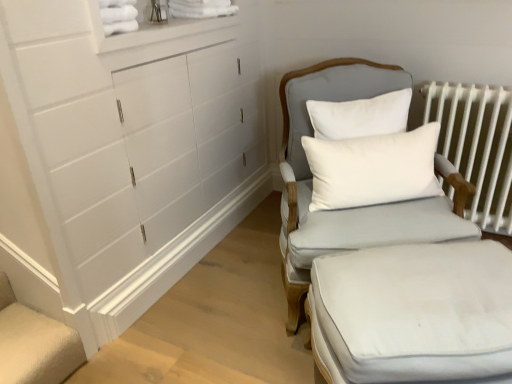
Question: From the image's perspective, is white fabric ottoman at lower right above white metal radiator at right?

Choices:
 (A) no
 (B) yes

Answer: (A)

Question: Considering the relative sizes of white fabric ottoman at lower right and white metal radiator at right in the image provided, is white fabric ottoman at lower right taller than white metal radiator at right?

Choices:
 (A) yes
 (B) no

Answer: (B)

Question: Could you tell me if white fabric ottoman at lower right is turned towards white metal radiator at right?

Choices:
 (A) yes
 (B) no

Answer: (B)

Question: From a real-world perspective, is white fabric ottoman at lower right below white metal radiator at right?

Choices:
 (A) no
 (B) yes

Answer: (B)

Question: Is white fabric ottoman at lower right thinner than white metal radiator at right?

Choices:
 (A) no
 (B) yes

Answer: (A)

Question: Considering the relative sizes of white fabric ottoman at lower right and white metal radiator at right in the image provided, is white fabric ottoman at lower right wider than white metal radiator at right?

Choices:
 (A) yes
 (B) no

Answer: (A)

Question: From the image's perspective, is white metal radiator at right on top of white fabric ottoman at lower right?

Choices:
 (A) no
 (B) yes

Answer: (B)

Question: Is white metal radiator at right not close to white fabric ottoman at lower right?

Choices:
 (A) yes
 (B) no

Answer: (B)

Question: Is white fabric ottoman at lower right completely or partially inside white metal radiator at right?

Choices:
 (A) yes
 (B) no

Answer: (B)

Question: Can you confirm if white metal radiator at right is shorter than white fabric ottoman at lower right?

Choices:
 (A) yes
 (B) no

Answer: (B)

Question: Can you confirm if white metal radiator at right is wider than white fabric ottoman at lower right?

Choices:
 (A) no
 (B) yes

Answer: (A)

Question: Considering the relative sizes of white metal radiator at right and white fabric ottoman at lower right in the image provided, is white metal radiator at right smaller than white fabric ottoman at lower right?

Choices:
 (A) yes
 (B) no

Answer: (A)

Question: Is light gray fabric chair at center-right oriented away from white metal radiator at right?

Choices:
 (A) no
 (B) yes

Answer: (A)